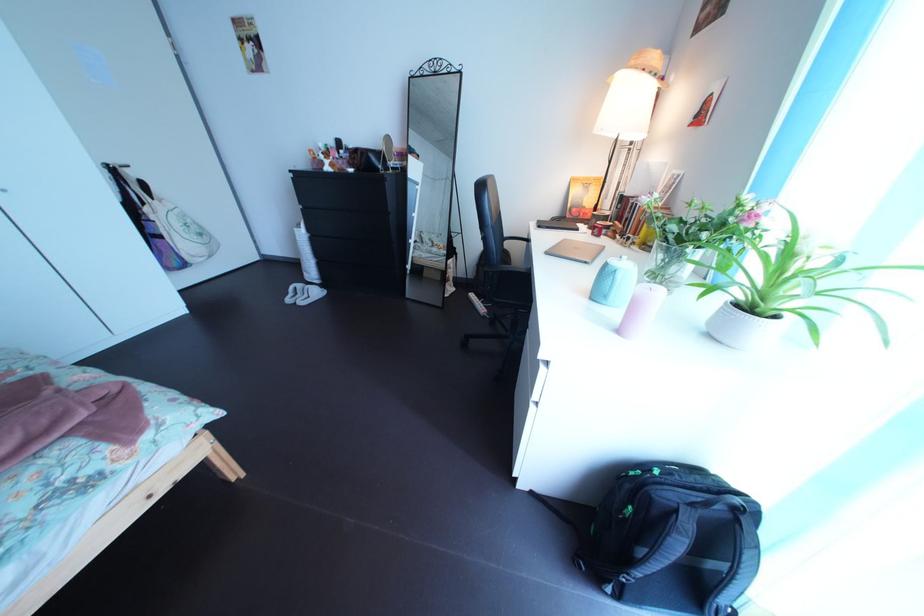
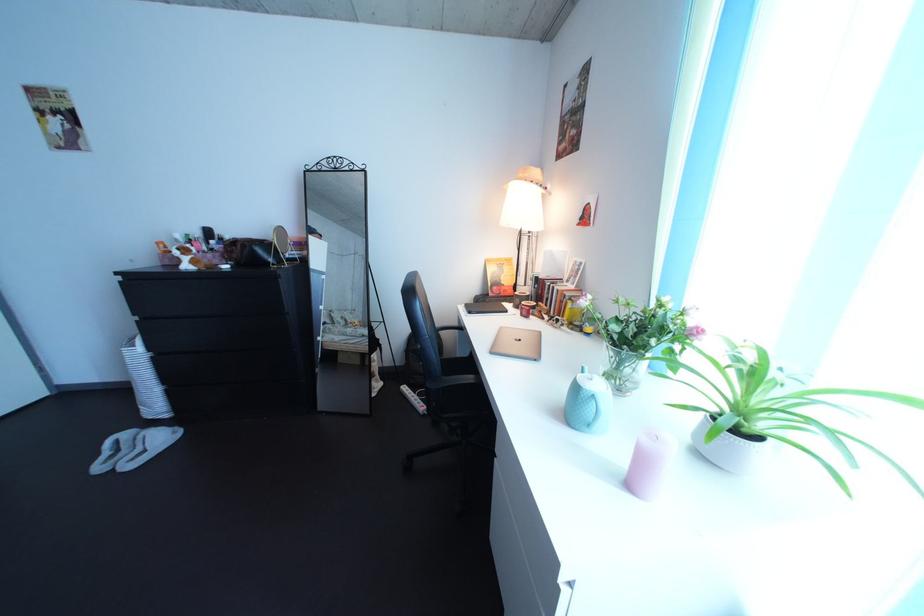
Question: How did the camera likely rotate?

Choices:
 (A) Left
 (B) Right
 (C) Up
 (D) Down

Answer: (B)